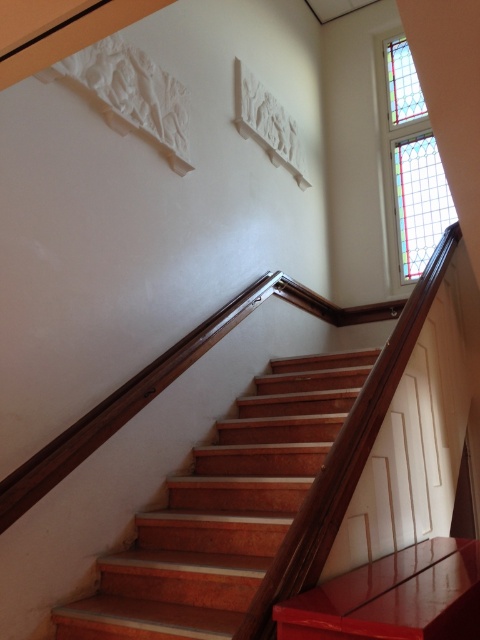
Is wooden stairs at center closer to the viewer compared to stained glass window at upper right?

That is True.

Describe the element at coordinates (223, 509) in the screenshot. I see `wooden stairs at center` at that location.

Which is in front, point (224, 451) or point (410, 220)?

Positioned in front is point (224, 451).

The image size is (480, 640). What are the coordinates of `wooden stairs at center` in the screenshot? It's located at (223, 509).